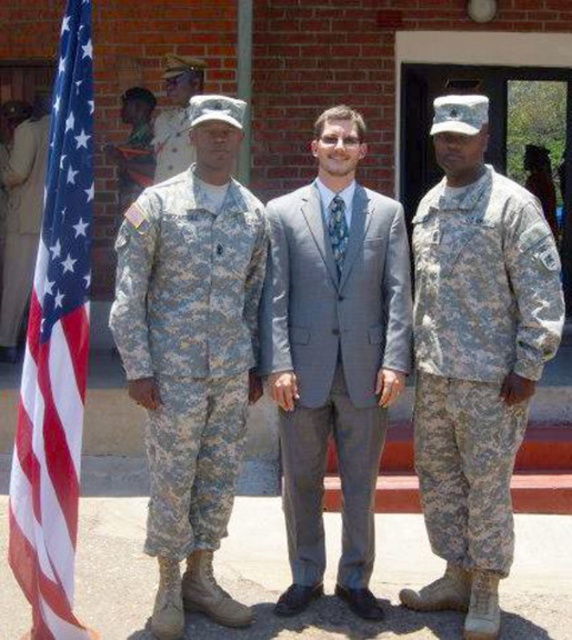
You are standing in front of the brick building and need to determine the relative positions of two points marked in the scene. Which point is closer to you, point (446, 497) or point (88, 636)?

Point (88, 636) is closer to you because it is less further to the camera than point (446, 497).